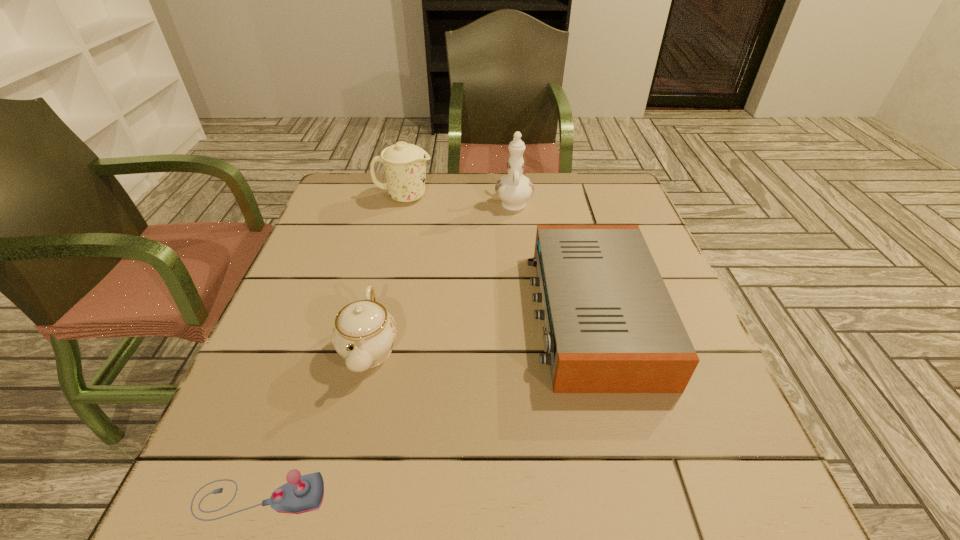
The width and height of the screenshot is (960, 540). What are the coordinates of `free point that satisfies the following two spatial constraints: 1. on the spout of the second shortest chinaware; 2. at the spout of the tallest object` in the screenshot? It's located at (403, 202).